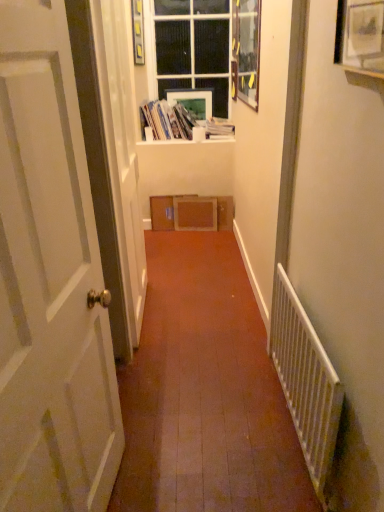
Measure the distance between wooden picture frame at upper right, the first picture frame viewed from the right, and camera.

wooden picture frame at upper right, the first picture frame viewed from the right, is 37.11 inches away from camera.

What do you see at coordinates (193, 48) in the screenshot?
I see `clear glass window at upper center` at bounding box center [193, 48].

Locate an element on the screen. Image resolution: width=384 pixels, height=512 pixels. white wooden door at left is located at coordinates (50, 282).

How much space does white paper book at upper center, placed as the second book when sorted from left to right, occupy vertically?

white paper book at upper center, placed as the second book when sorted from left to right, is 5.67 inches in height.

This screenshot has width=384, height=512. In order to click on matte white picture frame at upper center, marked as the 4th picture frame in a right-to-left arrangement in this screenshot , I will do `click(138, 32)`.

Image resolution: width=384 pixels, height=512 pixels. What do you see at coordinates (164, 211) in the screenshot?
I see `brown cardboard box at center` at bounding box center [164, 211].

How much space does wooden picture frame at upper center, which is the second picture frame from front to back, occupy vertically?

It is 67.71 centimeters.

You are a GUI agent. You are given a task and a screenshot of the screen. Output one action in this format:
    pyautogui.click(x=<x>, y=<y>)
    Task: Click on the white matte window sill at upper center
    
    Given the screenshot: What is the action you would take?
    pyautogui.click(x=187, y=140)

In the scene shown: How different are the orientations of clear glass window at upper center and matte white picture frame at upper center, the first picture frame from the left, in degrees?

There is a 77.4-degree angle between the facing directions of clear glass window at upper center and matte white picture frame at upper center, the first picture frame from the left.

The height and width of the screenshot is (512, 384). Find the location of `the 3rd picture frame located above the clear glass window at upper center (from a real-world perspective)`. the 3rd picture frame located above the clear glass window at upper center (from a real-world perspective) is located at coordinates (138, 32).

From the image's perspective, would you say clear glass window at upper center is shown under matte white picture frame at upper center, the first picture frame from the left?

Yes.

Considering their positions, is clear glass window at upper center located in front of or behind matte white picture frame at upper center, the first picture frame from the left?

clear glass window at upper center is positioned farther from the viewer than matte white picture frame at upper center, the first picture frame from the left.

Considering the points (161, 215) and (234, 140), which point is behind, point (161, 215) or point (234, 140)?

The point (161, 215) is behind.

Which object is more forward, brown cardboard box at center or white matte window sill at upper center?

white matte window sill at upper center.

The width and height of the screenshot is (384, 512). What are the coordinates of `window sill on the right side of brown cardboard box at center` in the screenshot? It's located at (187, 140).

From the image's perspective, is brown cardboard box at center positioned above or below white matte window sill at upper center?

Based on their image positions, brown cardboard box at center is located beneath white matte window sill at upper center.

Looking at this image, from a real-world perspective, who is located higher, white metallic radiator at right or wooden picture frame at upper right, the first picture frame viewed from the right?

wooden picture frame at upper right, the first picture frame viewed from the right, from a real-world perspective.

Based on the photo, how different are the orientations of white metallic radiator at right and wooden picture frame at upper right, the fourth picture frame from the back, in degrees?

0.0102 degrees separate the facing orientations of white metallic radiator at right and wooden picture frame at upper right, the fourth picture frame from the back.

Do you think white metallic radiator at right is within wooden picture frame at upper right, which is the fourth picture frame from left to right, or outside of it?

The correct answer is: outside.

Is white metallic radiator at right next to wooden picture frame at upper right, acting as the 1th picture frame starting from the front, and touching it?

There is a gap between white metallic radiator at right and wooden picture frame at upper right, acting as the 1th picture frame starting from the front.

Which object is closer to the camera, wooden picture frame at upper right, the fourth picture frame from the back, or white metallic radiator at right?

wooden picture frame at upper right, the fourth picture frame from the back.

From the image's perspective, is wooden picture frame at upper right, which is the fourth picture frame from left to right, beneath white metallic radiator at right?

No, from the image's perspective, wooden picture frame at upper right, which is the fourth picture frame from left to right, is not beneath white metallic radiator at right.

Is there a large distance between wooden picture frame at upper right, the fourth picture frame from the back, and white metallic radiator at right?

No, there isn't a large distance between wooden picture frame at upper right, the fourth picture frame from the back, and white metallic radiator at right.

Is matte white picture frame at upper center, which is counted as the third picture frame, starting from the front, positioned far away from white paper book at upper center, which ranks as the first book in right-to-left order?

No, matte white picture frame at upper center, which is counted as the third picture frame, starting from the front, is not far away from white paper book at upper center, which ranks as the first book in right-to-left order.

Is matte white picture frame at upper center, marked as the 4th picture frame in a right-to-left arrangement, oriented away from white paper book at upper center, placed as the second book when sorted from left to right?

No, matte white picture frame at upper center, marked as the 4th picture frame in a right-to-left arrangement, is not facing away from white paper book at upper center, placed as the second book when sorted from left to right.

Is matte white picture frame at upper center, which is counted as the third picture frame, starting from the front, spatially inside white paper book at upper center, placed as the second book when sorted from left to right, or outside of it?

matte white picture frame at upper center, which is counted as the third picture frame, starting from the front, is spatially situated outside white paper book at upper center, placed as the second book when sorted from left to right.

Is white wooden door at left at the back of white paper book at upper center, placed as the second book when sorted from left to right?

white paper book at upper center, placed as the second book when sorted from left to right, is not turned away from white wooden door at left.

Can you tell me how much white paper book at upper center, which ranks as the first book in right-to-left order, and white wooden door at left differ in facing direction?

81.8 degrees separate the facing orientations of white paper book at upper center, which ranks as the first book in right-to-left order, and white wooden door at left.

In terms of width, does white paper book at upper center, which ranks as the first book in right-to-left order, look wider or thinner when compared to white wooden door at left?

Clearly, white paper book at upper center, which ranks as the first book in right-to-left order, has more width compared to white wooden door at left.

How much distance is there between white paper book at upper center, which ranks as the first book in right-to-left order, and white wooden door at left?

white paper book at upper center, which ranks as the first book in right-to-left order, and white wooden door at left are 2.74 meters apart.

Is wooden picture frame at upper center, acting as the 2th picture frame starting from the right, spatially inside white metallic radiator at right, or outside of it?

wooden picture frame at upper center, acting as the 2th picture frame starting from the right, exists outside the volume of white metallic radiator at right.

Considering the sizes of objects wooden picture frame at upper center, which is the second picture frame from front to back, and white metallic radiator at right in the image provided, who is taller, wooden picture frame at upper center, which is the second picture frame from front to back, or white metallic radiator at right?

Standing taller between the two is wooden picture frame at upper center, which is the second picture frame from front to back.

From a real-world perspective, which picture frame is the 3rd one above the clear glass window at upper center? Please provide its 2D coordinates.

[(138, 32)]

Locate an element on the screen. This screenshot has width=384, height=512. shelf behind the white matte window sill at upper center is located at coordinates (164, 211).

Estimate the real-world distances between objects in this image. Which object is further from matte white picture frame at upper center, which is counted as the second picture frame, starting from the back, brown cardboard box at center or clear glass window at upper center?

Among the two, brown cardboard box at center is located further to matte white picture frame at upper center, which is counted as the second picture frame, starting from the back.

From the image, which object appears to be farther from wooden picture frame at upper right, the fourth picture frame from the back, white metallic radiator at right or matte white picture frame at upper center, which is counted as the second picture frame, starting from the back?

matte white picture frame at upper center, which is counted as the second picture frame, starting from the back.

Based on their spatial positions, is matte white picture frame at upper center, the first picture frame when ordered from back to front, or white matte window sill at upper center closer to wooden picture frame at upper center, which is the second picture frame from front to back?

Among the two, matte white picture frame at upper center, the first picture frame when ordered from back to front, is located nearer to wooden picture frame at upper center, which is the second picture frame from front to back.

Based on their spatial positions, is wooden picture frame at upper center, acting as the 2th picture frame starting from the right, or white matte window sill at upper center further from wooden picture frame at upper right, the first picture frame viewed from the right?

The object further to wooden picture frame at upper right, the first picture frame viewed from the right, is white matte window sill at upper center.

Which object lies further to the anchor point matte white picture frame at upper center, marked as the 4th picture frame in a right-to-left arrangement, white metallic radiator at right or white paper book at upper center, placed as the second book when sorted from left to right?

The object further to matte white picture frame at upper center, marked as the 4th picture frame in a right-to-left arrangement, is white metallic radiator at right.

When comparing their distances from white matte window sill at upper center, does wooden picture frame at upper center, which is the second picture frame from front to back, or matte white picture frame at upper center, the fourth picture frame when ordered from front to back, seem further?

wooden picture frame at upper center, which is the second picture frame from front to back, is further to white matte window sill at upper center.

Considering their positions, is brown cardboard box at center positioned further to matte white picture frame at upper center, which ranks as the second picture frame in left-to-right order, than white cardboard box at upper center, the 1th book positioned from the left?

Among the two, brown cardboard box at center is located further to matte white picture frame at upper center, which ranks as the second picture frame in left-to-right order.

When comparing their distances from matte white picture frame at upper center, which is counted as the second picture frame, starting from the back, does wooden picture frame at upper right, which is the fourth picture frame from left to right, or brown cardboard box at center seem further?

wooden picture frame at upper right, which is the fourth picture frame from left to right, is positioned further to the anchor matte white picture frame at upper center, which is counted as the second picture frame, starting from the back.

I want to click on window between wooden picture frame at upper right, the first picture frame viewed from the right, and matte white picture frame at upper center, the first picture frame when ordered from back to front, in the front-back direction, so click(193, 48).

The width and height of the screenshot is (384, 512). What are the coordinates of `window between wooden picture frame at upper right, acting as the 1th picture frame starting from the front, and white paper book at upper center, placed as the second book when sorted from left to right, from front to back` in the screenshot? It's located at (193, 48).

Where is `window between wooden picture frame at upper center, which is the second picture frame from front to back, and white cardboard box at upper center, which appears as the 2th book when viewed from the right, along the z-axis`? window between wooden picture frame at upper center, which is the second picture frame from front to back, and white cardboard box at upper center, which appears as the 2th book when viewed from the right, along the z-axis is located at coordinates (193, 48).

Find the location of `window sill between clear glass window at upper center and brown cardboard box at center vertically`. window sill between clear glass window at upper center and brown cardboard box at center vertically is located at coordinates (187, 140).